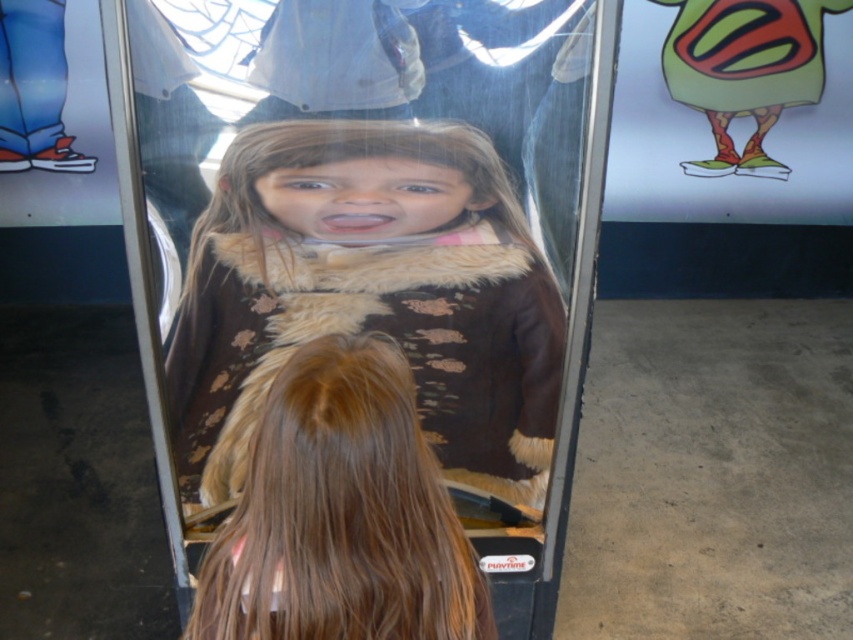
Question: Which of these objects is positioned farthest from the smooth brown coat at center?

Choices:
 (A) transparent plastic glass at center
 (B) brown fuzzy coat at center

Answer: (A)

Question: Does transparent plastic glass at center come behind smooth brown coat at center?

Choices:
 (A) yes
 (B) no

Answer: (A)

Question: Can you confirm if brown fuzzy coat at center is smaller than transparent plastic glass at center?

Choices:
 (A) no
 (B) yes

Answer: (B)

Question: Which object is positioned farthest from the brown fuzzy coat at center?

Choices:
 (A) smooth brown coat at center
 (B) transparent plastic glass at center

Answer: (A)

Question: Is transparent plastic glass at center above smooth brown coat at center?

Choices:
 (A) no
 (B) yes

Answer: (B)

Question: Which object is closer to the camera taking this photo?

Choices:
 (A) brown fuzzy coat at center
 (B) transparent plastic glass at center

Answer: (B)